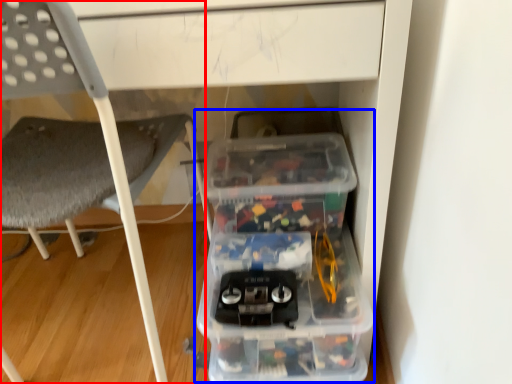
Question: Which object is closer to the camera taking this photo, chair (highlighted by a red box) or storage box (highlighted by a blue box)?

Choices:
 (A) chair
 (B) storage box

Answer: (A)